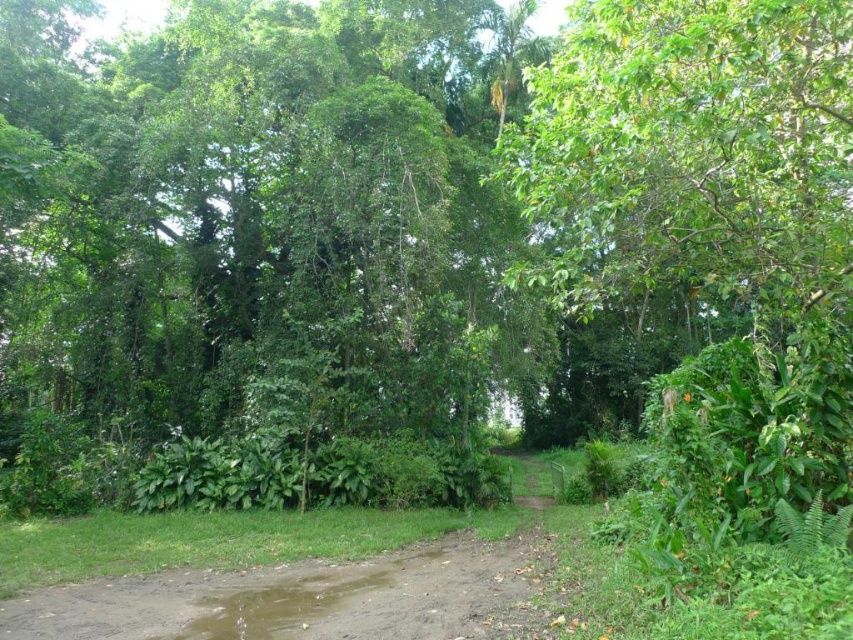
Question: Which point is farther from the camera taking this photo?

Choices:
 (A) (299, 548)
 (B) (480, 22)

Answer: (B)

Question: Does green leafy tree at center have a larger size compared to brown dirt track at center?

Choices:
 (A) yes
 (B) no

Answer: (A)

Question: In this image, where is green leafy tree at center located relative to brown dirt track at center?

Choices:
 (A) left
 (B) right

Answer: (A)

Question: Does green leafy tree at center have a greater width compared to brown dirt track at center?

Choices:
 (A) no
 (B) yes

Answer: (B)

Question: Which point appears farthest from the camera in this image?

Choices:
 (A) (33, 593)
 (B) (442, 298)

Answer: (B)